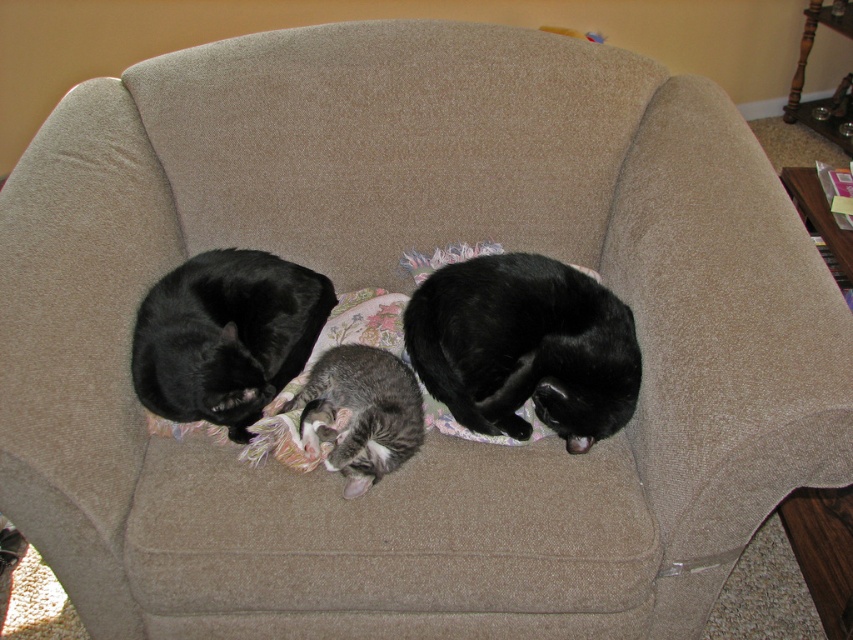
Question: Which of these objects is positioned closest to the black fur cat at left?

Choices:
 (A) black fur cat at center
 (B) gray tabby cat at center

Answer: (B)

Question: Observing the image, what is the correct spatial positioning of black fur cat at left in reference to gray tabby cat at center?

Choices:
 (A) above
 (B) below

Answer: (A)

Question: Where is black fur cat at left located in relation to gray tabby cat at center in the image?

Choices:
 (A) left
 (B) right

Answer: (A)

Question: Does black fur cat at center have a smaller size compared to black fur cat at left?

Choices:
 (A) yes
 (B) no

Answer: (A)

Question: Which object is closer to the camera taking this photo?

Choices:
 (A) black fur cat at left
 (B) black fur cat at center

Answer: (B)

Question: Which point is closer to the camera taking this photo?

Choices:
 (A) (199, 369)
 (B) (561, 404)

Answer: (B)